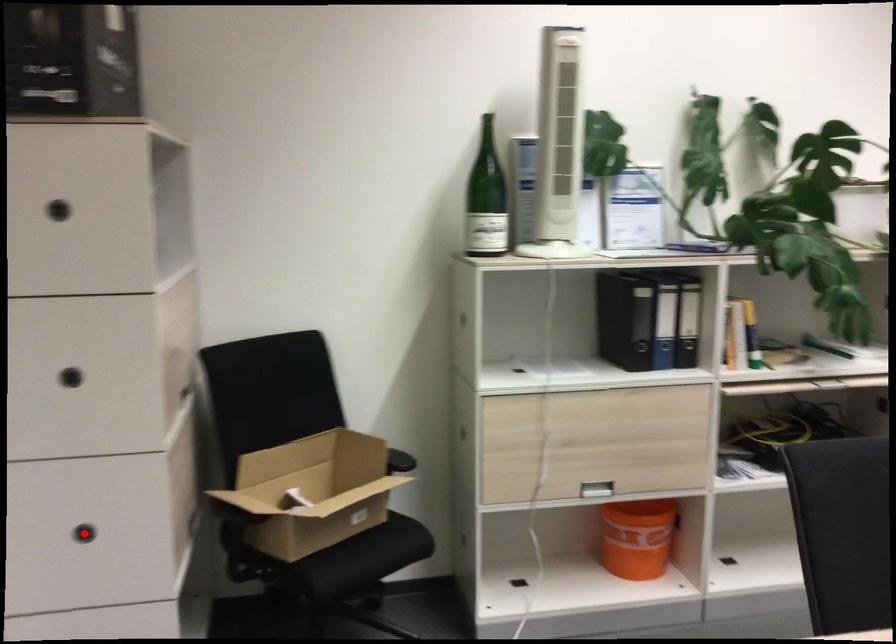
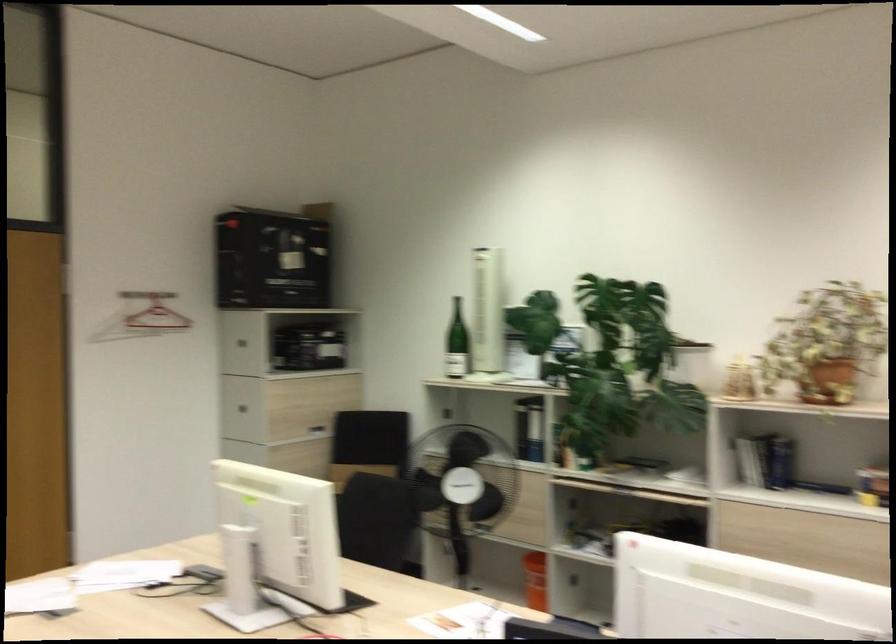
Question: I am providing you with two images of the same scene from different viewpoints. A red point is marked on the first image. Is the red point's position out of view in image 2?

Choices:
 (A) Yes
 (B) No

Answer: (A)